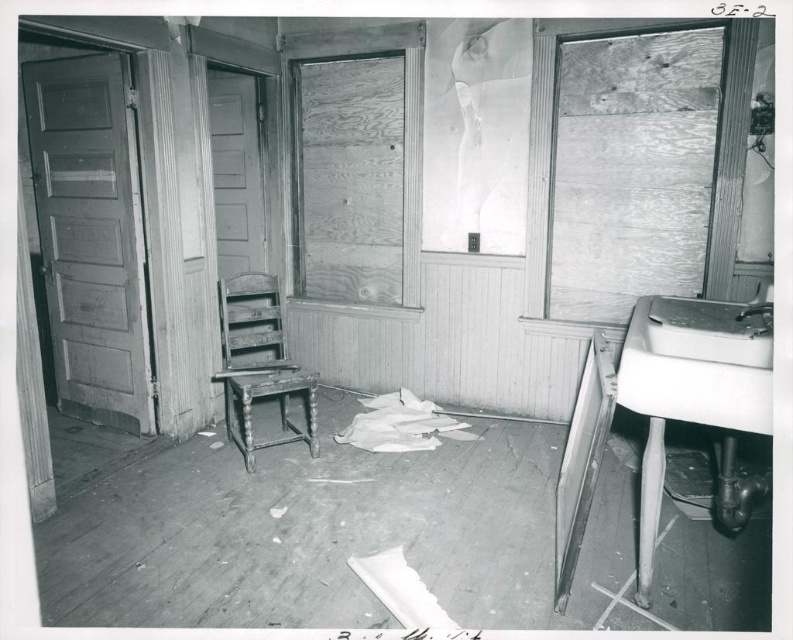
Can you confirm if wooden paneling at right is bigger than wooden chair at center?

No.

Is point (676, 35) less distant than point (253, 397)?

Yes, it is.

I want to click on wooden paneling at right, so click(x=631, y=170).

Who is more distant from viewer, (278, 374) or (703, 419)?

The point (278, 374) is more distant.

Can you confirm if wooden chair at center is positioned to the left of white porcelain sink at right?

Yes, wooden chair at center is to the left of white porcelain sink at right.

I want to click on wooden chair at center, so click(259, 362).

Find the location of a particular element. wooden chair at center is located at coordinates tap(259, 362).

Image resolution: width=793 pixels, height=640 pixels. Describe the element at coordinates (631, 170) in the screenshot. I see `wooden paneling at right` at that location.

How distant is wooden paneling at right from white porcelain sink at right?

wooden paneling at right is 1.15 meters from white porcelain sink at right.

Which is in front, point (623, 317) or point (642, 353)?

Positioned in front is point (642, 353).

Find the location of a particular element. This screenshot has height=640, width=793. wooden paneling at right is located at coordinates (631, 170).